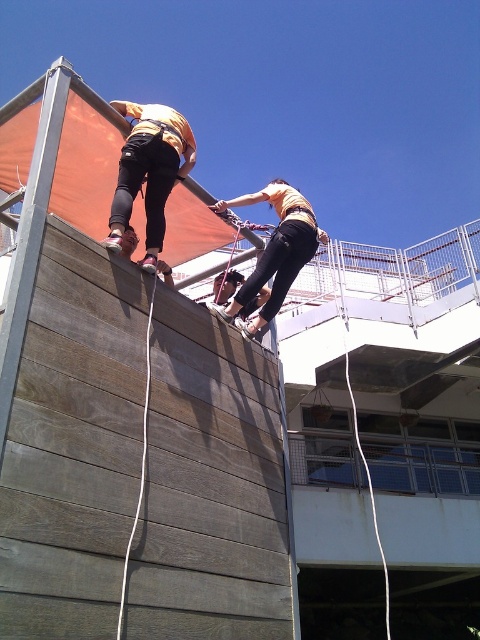
You are a safety inspector checking the climbing wall. You notice two climbers, one wearing matte black pants at upper left and another in matte yellow shirt at center. Which climber is positioned closer to the top of the wall?

The matte black pants at upper left is closer to the viewer than matte yellow shirt at center, so the climber in matte black pants at upper left is closer to the top of the wall.